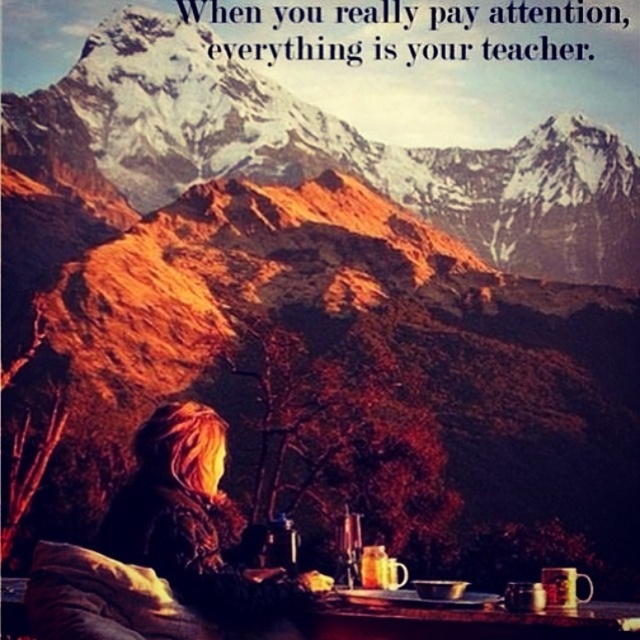
Question: Which point appears farthest from the camera in this image?

Choices:
 (A) [x=237, y=20]
 (B) [x=584, y=51]

Answer: (B)

Question: Which object appears farthest from the camera in this image?

Choices:
 (A) shiny brown jacket at lower left
 (B) snowy granite mountain at upper center

Answer: (B)

Question: Is snowy granite mountain at upper center behind white paper at upper center?

Choices:
 (A) no
 (B) yes

Answer: (A)

Question: Which point appears closest to the camera in this image?

Choices:
 (A) (134, 132)
 (B) (612, 28)
 (C) (212, 444)

Answer: (C)

Question: Is snowy granite mountain at upper center above white paper at upper center?

Choices:
 (A) no
 (B) yes

Answer: (A)

Question: Is snowy granite mountain at upper center below white paper at upper center?

Choices:
 (A) no
 (B) yes

Answer: (B)